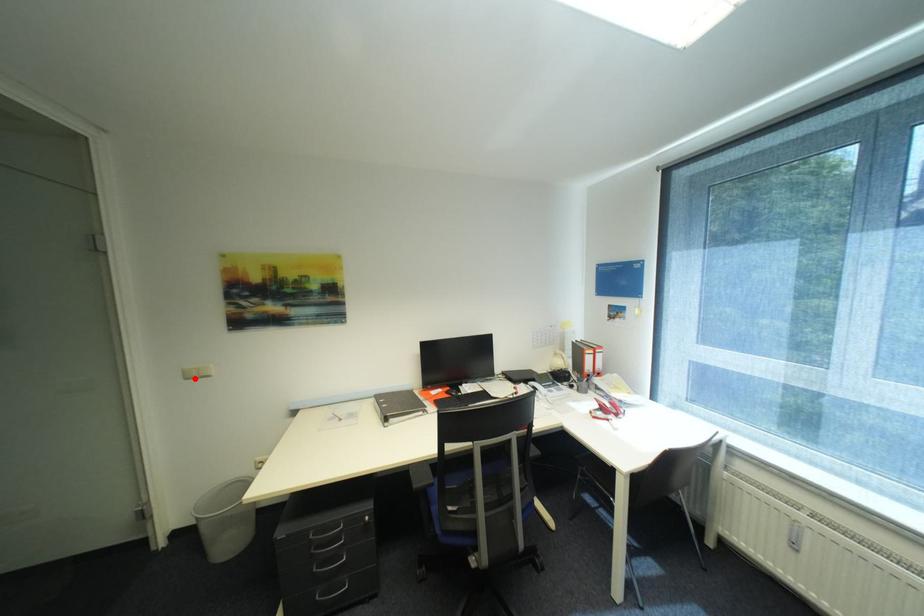
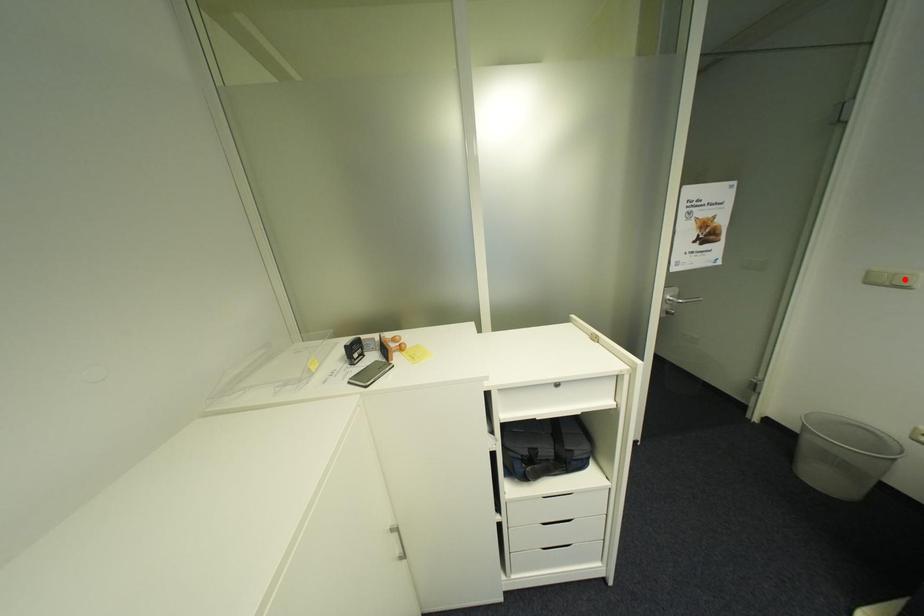
I am providing you with two images of the same scene from different viewpoints. A red point is marked on the first image and another point is marked on the second image. Does the point marked in image1 correspond to the same location as the one in image2?

No